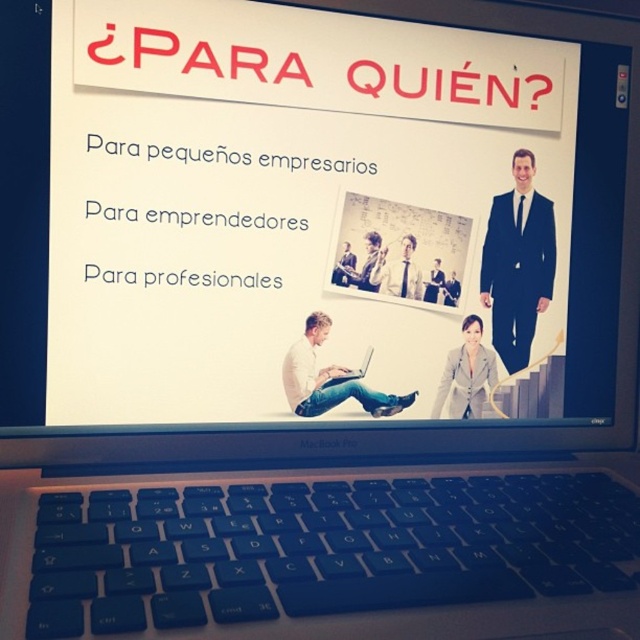
Between point (296, 384) and point (326, 381), which one is positioned behind?

Positioned behind is point (326, 381).

Does white matte laptop at center have a greater width compared to silver metallic laptop at center?

Yes, white matte laptop at center is wider than silver metallic laptop at center.

Is point (296, 387) positioned before point (369, 355)?

Yes, it is.

Locate an element on the screen. This screenshot has height=640, width=640. white matte laptop at center is located at coordinates (330, 378).

Between blue plastic keyboard at lower center and silver metallic laptop at center, which one has less height?

silver metallic laptop at center is shorter.

Is blue plastic keyboard at lower center taller than silver metallic laptop at center?

Indeed, blue plastic keyboard at lower center has a greater height compared to silver metallic laptop at center.

What are the coordinates of `blue plastic keyboard at lower center` in the screenshot? It's located at (333, 557).

Is blue plastic keyboard at lower center thinner than white matte laptop at center?

No, blue plastic keyboard at lower center is not thinner than white matte laptop at center.

Measure the distance between blue plastic keyboard at lower center and camera.

A distance of 12.37 inches exists between blue plastic keyboard at lower center and camera.

Between point (566, 588) and point (292, 378), which one is positioned in front?

Positioned in front is point (566, 588).

Locate an element on the screen. The width and height of the screenshot is (640, 640). blue plastic keyboard at lower center is located at coordinates (333, 557).